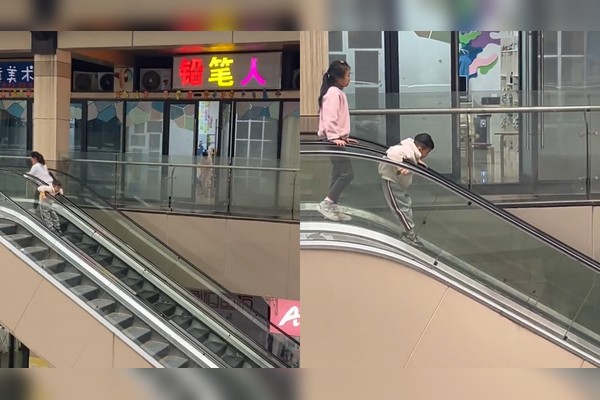
Locate an element on the screen. pillar is located at coordinates (50, 99).